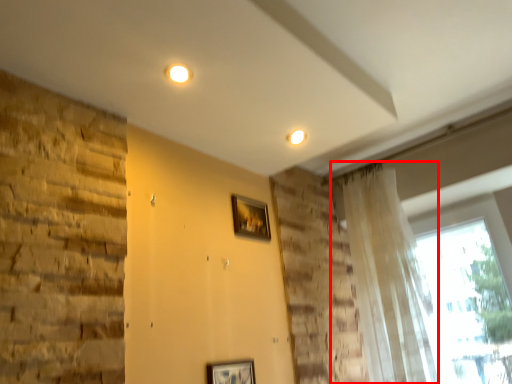
Question: From the image's perspective, where is curtain (annotated by the red box) located in relation to picture frame in the image?

Choices:
 (A) above
 (B) below

Answer: (B)